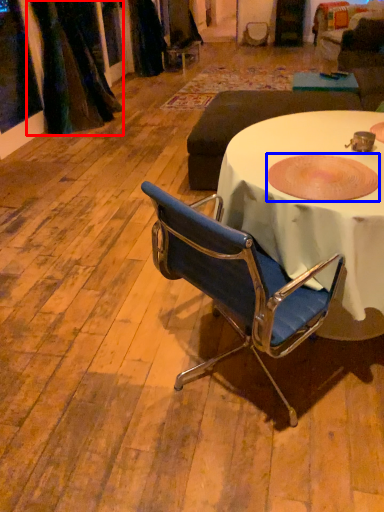
Question: Among these objects, which one is farthest to the camera, curtain (highlighted by a red box) or bowl (highlighted by a blue box)?

Choices:
 (A) curtain
 (B) bowl

Answer: (A)